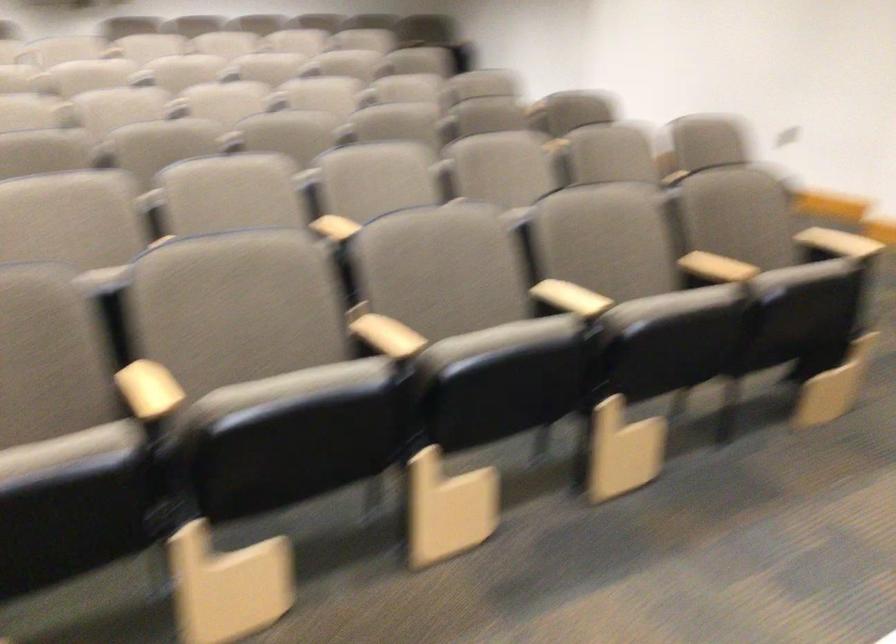
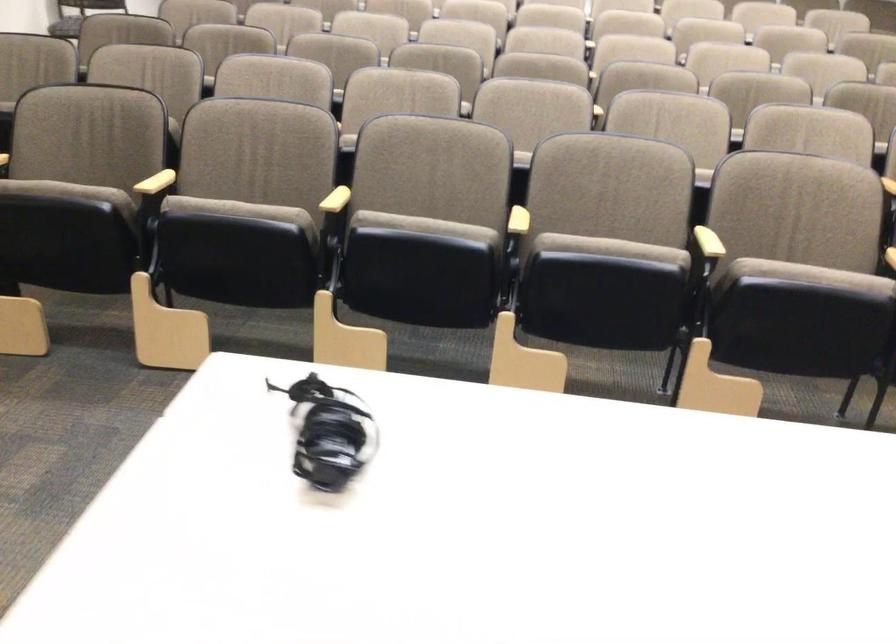
Find the pixel in the second image that matches (501,339) in the first image.

(610, 249)